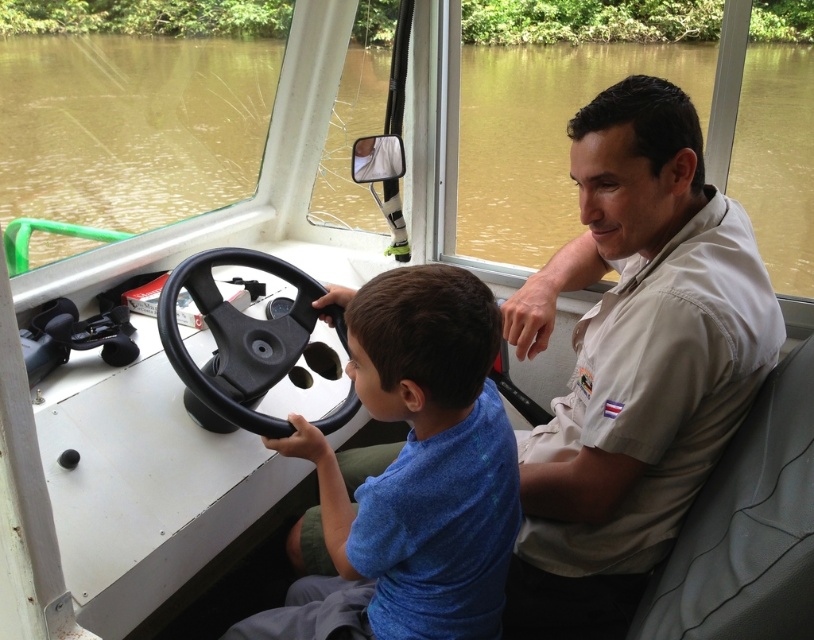
Question: Is white cotton shirt at right thinner than black rubber steering wheel at center?

Choices:
 (A) yes
 (B) no

Answer: (B)

Question: Which of the following is the farthest from the observer?

Choices:
 (A) (200, 144)
 (B) (615, 577)
 (C) (272, 348)

Answer: (A)

Question: Is white cotton shirt at right wider than black rubber steering wheel at center?

Choices:
 (A) no
 (B) yes

Answer: (B)

Question: Which point appears farthest from the camera in this image?

Choices:
 (A) (685, 352)
 (B) (466, 554)
 (C) (773, 93)

Answer: (C)

Question: Does white cotton shirt at right appear on the right side of blue matte shirt at center?

Choices:
 (A) yes
 (B) no

Answer: (A)

Question: Estimate the real-world distances between objects in this image. Which object is closer to the black rubber steering wheel at center?

Choices:
 (A) blue matte shirt at center
 (B) brown murky water at upper center

Answer: (A)